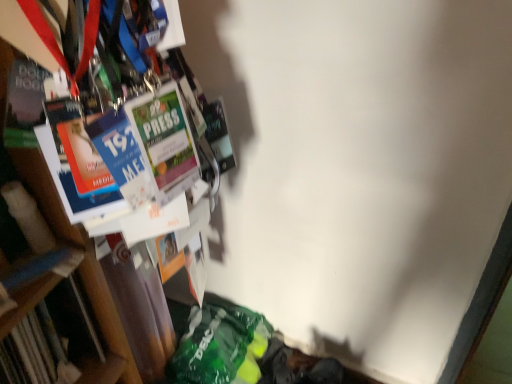
Question: Is hardcover book at left smaller than wooden bookcase at left?

Choices:
 (A) yes
 (B) no

Answer: (A)

Question: Is hardcover book at left further to camera compared to wooden bookcase at left?

Choices:
 (A) no
 (B) yes

Answer: (B)

Question: Considering the relative sizes of hardcover book at left and wooden bookcase at left in the image provided, is hardcover book at left taller than wooden bookcase at left?

Choices:
 (A) yes
 (B) no

Answer: (B)

Question: Could you tell me if hardcover book at left is turned towards wooden bookcase at left?

Choices:
 (A) yes
 (B) no

Answer: (B)

Question: From a real-world perspective, is hardcover book at left positioned under wooden bookcase at left based on gravity?

Choices:
 (A) no
 (B) yes

Answer: (B)

Question: Does hardcover book at left have a lesser height compared to wooden bookcase at left?

Choices:
 (A) no
 (B) yes

Answer: (B)

Question: Considering the relative sizes of wooden bookcase at left and hardcover book at left in the image provided, is wooden bookcase at left taller than hardcover book at left?

Choices:
 (A) yes
 (B) no

Answer: (A)

Question: Is wooden bookcase at left located outside hardcover book at left?

Choices:
 (A) no
 (B) yes

Answer: (B)

Question: Considering the relative sizes of wooden bookcase at left and hardcover book at left in the image provided, is wooden bookcase at left bigger than hardcover book at left?

Choices:
 (A) yes
 (B) no

Answer: (A)

Question: Is wooden bookcase at left next to hardcover book at left and touching it?

Choices:
 (A) no
 (B) yes

Answer: (B)

Question: Does wooden bookcase at left come behind hardcover book at left?

Choices:
 (A) yes
 (B) no

Answer: (B)

Question: Is wooden bookcase at left surrounding hardcover book at left?

Choices:
 (A) yes
 (B) no

Answer: (B)

Question: From the image's perspective, is wooden bookcase at left above or below hardcover book at left?

Choices:
 (A) above
 (B) below

Answer: (A)